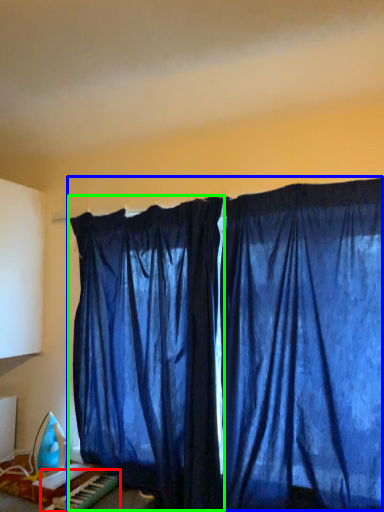
Question: Based on their relative distances, which object is farther from musical keyboard (highlighted by a red box)? Choose from curtain (highlighted by a blue box) and curtain (highlighted by a green box).

Choices:
 (A) curtain
 (B) curtain

Answer: (A)